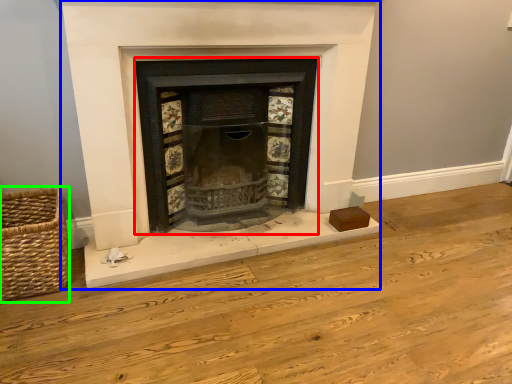
Question: Estimate the real-world distances between objects in this image. Which object is farther from wood burning stove (highlighted by a red box), fireplace (highlighted by a blue box) or basket (highlighted by a green box)?

Choices:
 (A) fireplace
 (B) basket

Answer: (B)